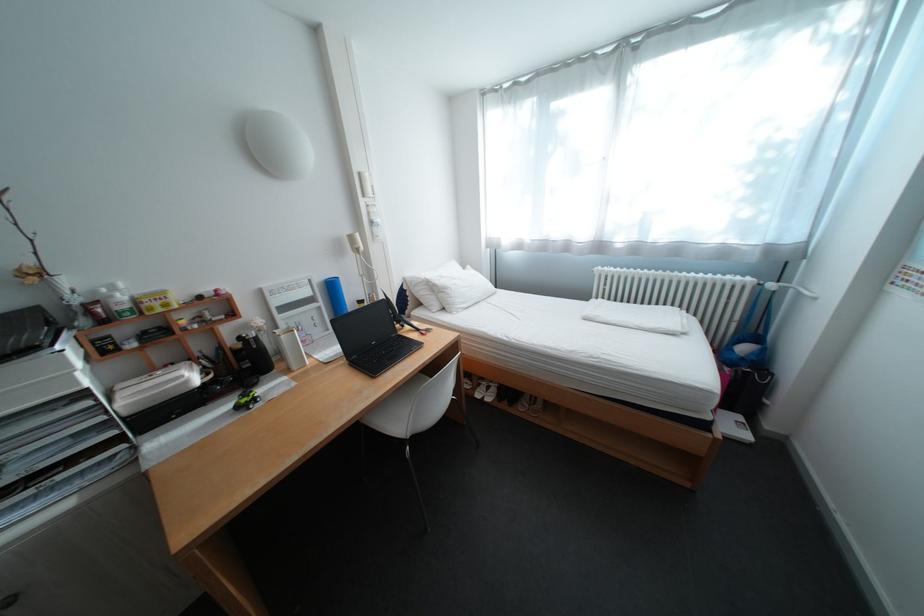
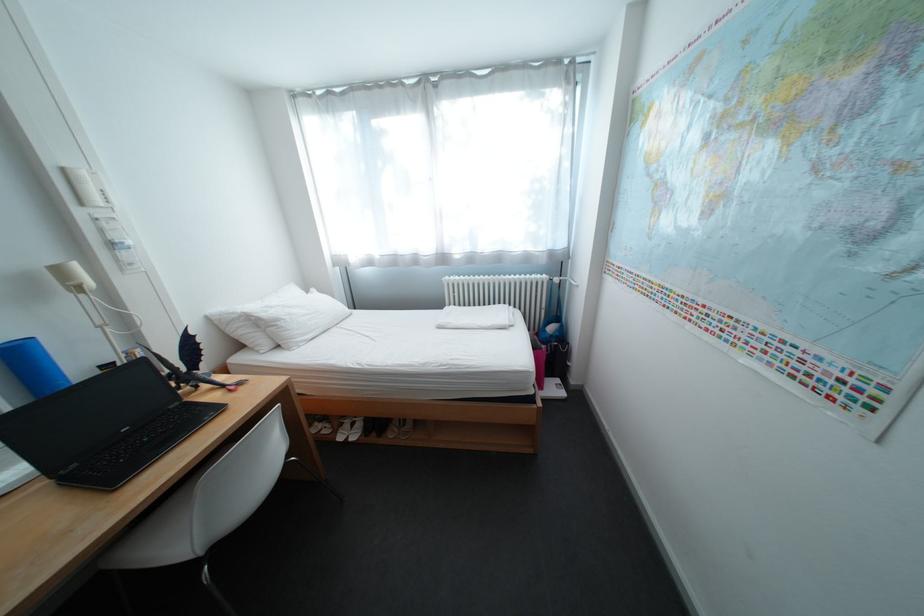
Locate, in the second image, the point that corresponds to pixel 371 175 in the first image.

(76, 171)